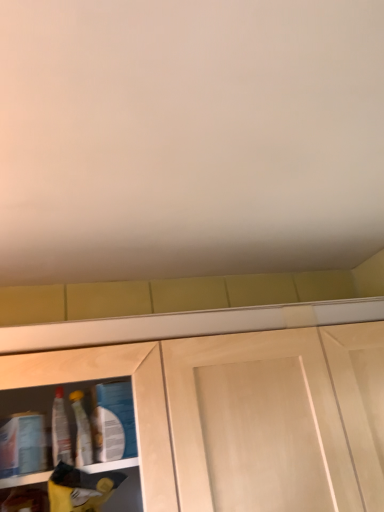
Describe the element at coordinates (239, 400) in the screenshot. I see `light wood cabinet at lower left` at that location.

I want to click on light wood cabinet at lower left, so click(239, 400).

You are a GUI agent. You are given a task and a screenshot of the screen. Output one action in this format:
    pyautogui.click(x=<x>, y=<y>)
    Task: Click on the light wood cabinet at lower left
    The image size is (384, 512).
    Given the screenshot: What is the action you would take?
    pos(239,400)